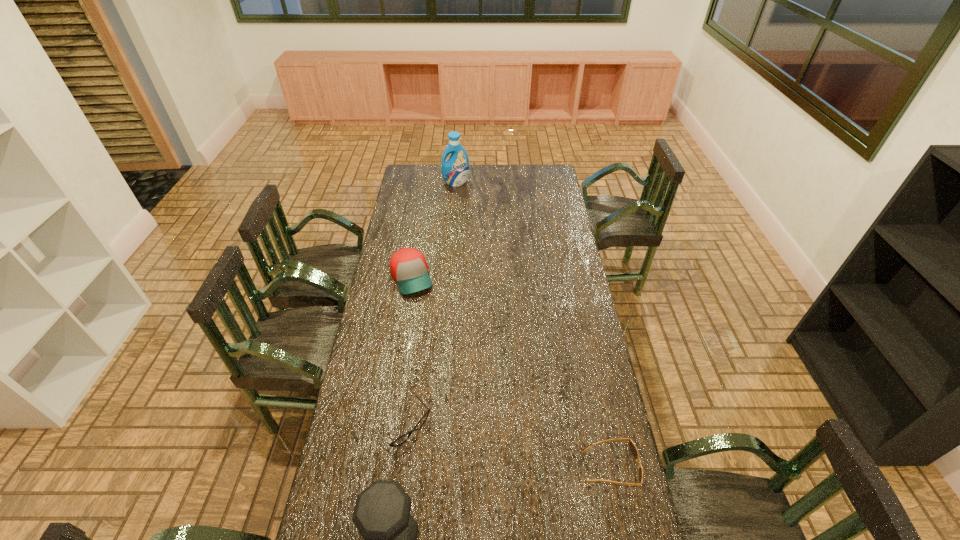
What are the coordinates of `free spot located 0.110m on the front-facing side of the spectacles` in the screenshot? It's located at (445, 468).

This screenshot has height=540, width=960. Find the location of `blank space located on the front-facing side of the spectacles`. blank space located on the front-facing side of the spectacles is located at coordinates pyautogui.click(x=452, y=475).

You are a GUI agent. You are given a task and a screenshot of the screen. Output one action in this format:
    pyautogui.click(x=<x>, y=<y>)
    Task: Click on the free space located on the front-facing side of the spectacles
    The width and height of the screenshot is (960, 540).
    Given the screenshot: What is the action you would take?
    pyautogui.click(x=445, y=468)

Identify the location of free region located on the front-facing side of the farthest object. (464, 211).

The image size is (960, 540). In order to click on blank space located 0.400m on the front-facing side of the farthest object in this screenshot , I will do `click(468, 228)`.

The height and width of the screenshot is (540, 960). I want to click on free space located 0.390m on the front-facing side of the farthest object, so click(x=468, y=227).

At what (x,y) coordinates should I click in order to perform the action: click on object positioned at the far edge. Please return your answer as a coordinate pair (x, y). The width and height of the screenshot is (960, 540). Looking at the image, I should click on (455, 171).

This screenshot has height=540, width=960. I want to click on baseball cap that is at the left edge, so click(408, 266).

Find the location of `spectacles that is at the left edge`. spectacles that is at the left edge is located at coordinates (403, 438).

The image size is (960, 540). Identify the location of object present at the right edge. (633, 449).